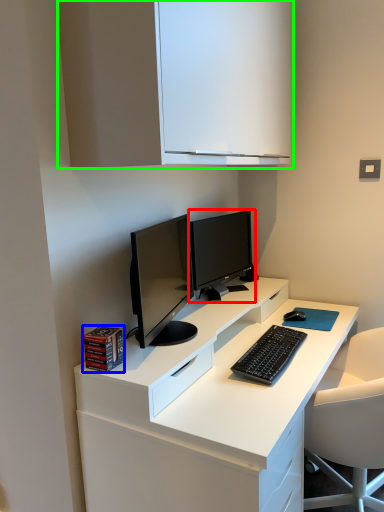
Question: Considering the real-world distances, which object is closest to computer monitor (highlighted by a red box)? book (highlighted by a blue box) or cabinetry (highlighted by a green box).

Choices:
 (A) book
 (B) cabinetry

Answer: (B)